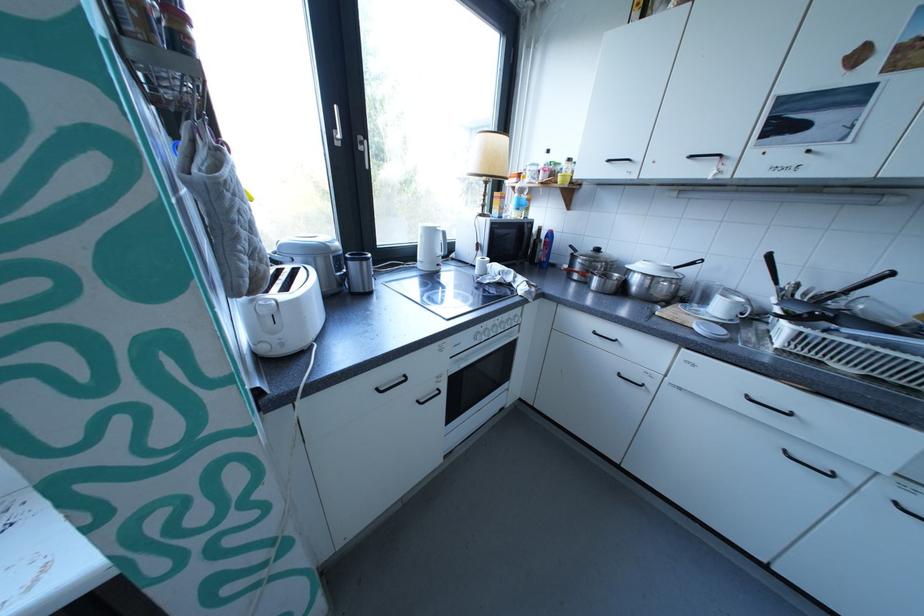
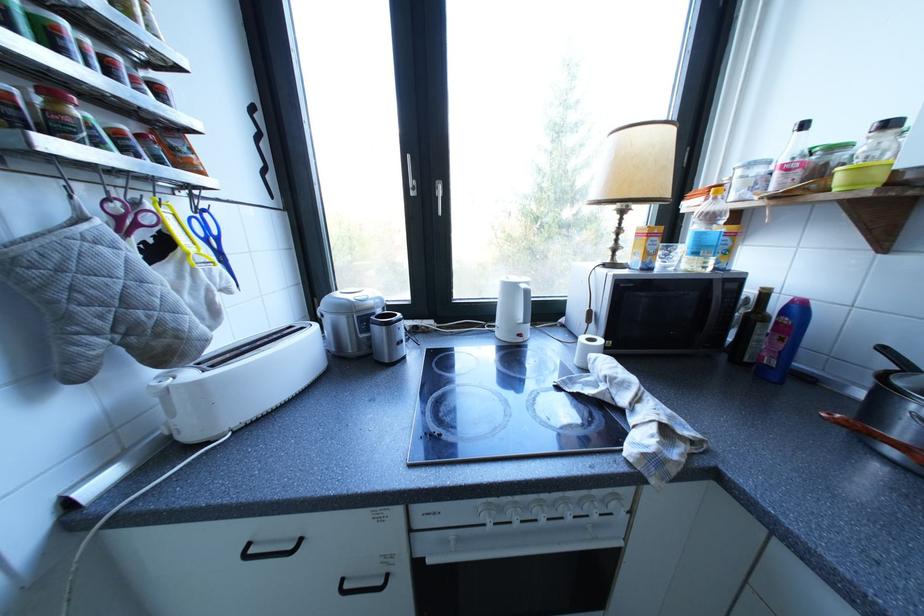
Locate, in the second image, the point that corresponds to (560,236) in the first image.

(797, 312)